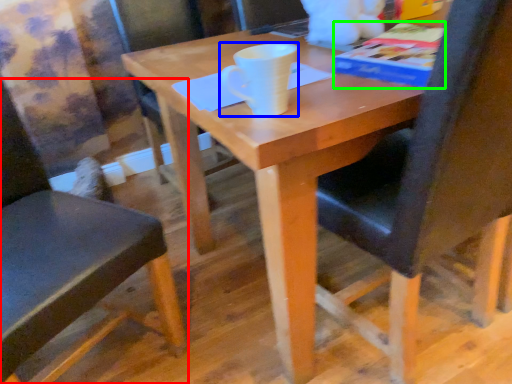
Question: Based on their relative distances, which object is farther from chair (highlighted by a red box)? Choose from coffee cup (highlighted by a blue box) and paperback book (highlighted by a green box).

Choices:
 (A) coffee cup
 (B) paperback book

Answer: (B)